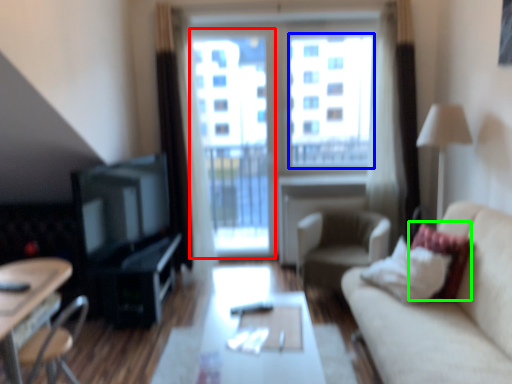
Question: Based on their relative distances, which object is nearer to screen door (highlighted by a red box)? Choose from window screen (highlighted by a blue box) and pillow (highlighted by a green box).

Choices:
 (A) window screen
 (B) pillow

Answer: (A)